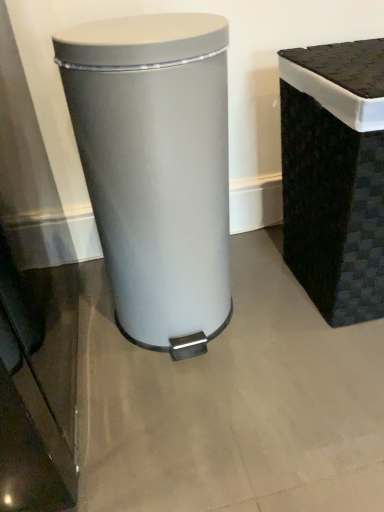
What is the approximate height of black woven basket at right, which is the 2th waste container from left to right?

black woven basket at right, which is the 2th waste container from left to right, is 22.10 inches in height.

Locate an element on the screen. The image size is (384, 512). black woven basket at right, which is the first waste container in right-to-left order is located at coordinates (335, 176).

This screenshot has height=512, width=384. Describe the element at coordinates (335, 176) in the screenshot. I see `black woven basket at right, which is the 2th waste container from left to right` at that location.

This screenshot has width=384, height=512. Find the location of `satin silver trash can at center, which is the first waste container in left-to-right order`. satin silver trash can at center, which is the first waste container in left-to-right order is located at coordinates (156, 169).

Describe the element at coordinates (156, 169) in the screenshot. I see `satin silver trash can at center, which is the first waste container in left-to-right order` at that location.

Identify the location of black woven basket at right, which is the first waste container in right-to-left order. This screenshot has width=384, height=512. (335, 176).

Between black woven basket at right, which is the first waste container in right-to-left order, and satin silver trash can at center, the 2th waste container from the right, which one appears on the left side from the viewer's perspective?

satin silver trash can at center, the 2th waste container from the right.

Considering the positions of objects black woven basket at right, which is the 2th waste container from left to right, and satin silver trash can at center, the 2th waste container from the right, in the image provided, who is behind, black woven basket at right, which is the 2th waste container from left to right, or satin silver trash can at center, the 2th waste container from the right,?

black woven basket at right, which is the 2th waste container from left to right.

Considering the positions of point (302, 280) and point (148, 154), is point (302, 280) closer or farther from the camera than point (148, 154)?

Point (302, 280) is positioned farther from the camera compared to point (148, 154).

From the image's perspective, which one is positioned lower, black woven basket at right, which is the first waste container in right-to-left order, or satin silver trash can at center, which is the first waste container in left-to-right order?

satin silver trash can at center, which is the first waste container in left-to-right order, appears lower in the image.

From a real-world perspective, is black woven basket at right, which is the 2th waste container from left to right, physically located above or below satin silver trash can at center, which is the first waste container in left-to-right order?

black woven basket at right, which is the 2th waste container from left to right, is situated lower than satin silver trash can at center, which is the first waste container in left-to-right order, in the real world.

Does black woven basket at right, which is the 2th waste container from left to right, have a greater width compared to satin silver trash can at center, the 2th waste container from the right?

Correct, the width of black woven basket at right, which is the 2th waste container from left to right, exceeds that of satin silver trash can at center, the 2th waste container from the right.

Considering the relative sizes of black woven basket at right, which is the 2th waste container from left to right, and satin silver trash can at center, which is the first waste container in left-to-right order, in the image provided, is black woven basket at right, which is the 2th waste container from left to right, shorter than satin silver trash can at center, which is the first waste container in left-to-right order,?

Yes.

Based on their sizes in the image, would you say black woven basket at right, which is the first waste container in right-to-left order, is bigger or smaller than satin silver trash can at center, the 2th waste container from the right?

Clearly, black woven basket at right, which is the first waste container in right-to-left order, is larger in size than satin silver trash can at center, the 2th waste container from the right.

Which is correct: black woven basket at right, which is the first waste container in right-to-left order, is inside satin silver trash can at center, the 2th waste container from the right, or outside of it?

black woven basket at right, which is the first waste container in right-to-left order, cannot be found inside satin silver trash can at center, the 2th waste container from the right.

Does black woven basket at right, which is the first waste container in right-to-left order, touch satin silver trash can at center, the 2th waste container from the right?

No, black woven basket at right, which is the first waste container in right-to-left order, is not beside satin silver trash can at center, the 2th waste container from the right.

Is black woven basket at right, which is the first waste container in right-to-left order, aimed at satin silver trash can at center, the 2th waste container from the right?

No, black woven basket at right, which is the first waste container in right-to-left order, is not turned towards satin silver trash can at center, the 2th waste container from the right.

How many degrees apart are the facing directions of black woven basket at right, which is the 2th waste container from left to right, and satin silver trash can at center, the 2th waste container from the right?

They differ by 0.00237 degrees in their facing directions.

Measure the distance from black woven basket at right, which is the first waste container in right-to-left order, to satin silver trash can at center, which is the first waste container in left-to-right order.

black woven basket at right, which is the first waste container in right-to-left order, is 11.56 inches from satin silver trash can at center, which is the first waste container in left-to-right order.

You are a GUI agent. You are given a task and a screenshot of the screen. Output one action in this format:
    pyautogui.click(x=<x>, y=<y>)
    Task: Click on the waste container that appears below the black woven basket at right, which is the 2th waste container from left to right (from the image's perspective)
    This screenshot has width=384, height=512.
    Given the screenshot: What is the action you would take?
    pyautogui.click(x=156, y=169)

Can you confirm if satin silver trash can at center, the 2th waste container from the right, is positioned to the left of black woven basket at right, which is the first waste container in right-to-left order?

Correct, you'll find satin silver trash can at center, the 2th waste container from the right, to the left of black woven basket at right, which is the first waste container in right-to-left order.

Considering the relative positions of satin silver trash can at center, which is the first waste container in left-to-right order, and black woven basket at right, which is the first waste container in right-to-left order, in the image provided, is satin silver trash can at center, which is the first waste container in left-to-right order, behind black woven basket at right, which is the first waste container in right-to-left order,?

That is False.

Is point (178, 210) positioned before point (329, 315)?

Yes.

From the image's perspective, which is below, satin silver trash can at center, which is the first waste container in left-to-right order, or black woven basket at right, which is the 2th waste container from left to right?

satin silver trash can at center, which is the first waste container in left-to-right order.

From a real-world perspective, is satin silver trash can at center, which is the first waste container in left-to-right order, under black woven basket at right, which is the 2th waste container from left to right?

Actually, satin silver trash can at center, which is the first waste container in left-to-right order, is physically above black woven basket at right, which is the 2th waste container from left to right, in the real world.

Considering the sizes of objects satin silver trash can at center, which is the first waste container in left-to-right order, and black woven basket at right, which is the 2th waste container from left to right, in the image provided, who is thinner, satin silver trash can at center, which is the first waste container in left-to-right order, or black woven basket at right, which is the 2th waste container from left to right,?

Thinner between the two is satin silver trash can at center, which is the first waste container in left-to-right order.

Is satin silver trash can at center, which is the first waste container in left-to-right order, taller or shorter than black woven basket at right, which is the first waste container in right-to-left order?

Considering their sizes, satin silver trash can at center, which is the first waste container in left-to-right order, has more height than black woven basket at right, which is the first waste container in right-to-left order.

Between satin silver trash can at center, the 2th waste container from the right, and black woven basket at right, which is the first waste container in right-to-left order, which one has smaller size?

Smaller between the two is satin silver trash can at center, the 2th waste container from the right.

Is satin silver trash can at center, the 2th waste container from the right, situated inside black woven basket at right, which is the first waste container in right-to-left order, or outside?

satin silver trash can at center, the 2th waste container from the right, is located beyond the bounds of black woven basket at right, which is the first waste container in right-to-left order.

Is satin silver trash can at center, the 2th waste container from the right, touching black woven basket at right, which is the 2th waste container from left to right?

There is a gap between satin silver trash can at center, the 2th waste container from the right, and black woven basket at right, which is the 2th waste container from left to right.

Is satin silver trash can at center, which is the first waste container in left-to-right order, turned away from black woven basket at right, which is the 2th waste container from left to right?

No, satin silver trash can at center, which is the first waste container in left-to-right order,'s orientation is not away from black woven basket at right, which is the 2th waste container from left to right.

How many degrees apart are the facing directions of satin silver trash can at center, which is the first waste container in left-to-right order, and black woven basket at right, which is the 2th waste container from left to right?

The angular difference between satin silver trash can at center, which is the first waste container in left-to-right order, and black woven basket at right, which is the 2th waste container from left to right, is 0.00237 degrees.

The width and height of the screenshot is (384, 512). Find the location of `waste container that is on the left side of black woven basket at right, which is the 2th waste container from left to right`. waste container that is on the left side of black woven basket at right, which is the 2th waste container from left to right is located at coordinates (156, 169).

Identify the location of waste container that is behind the satin silver trash can at center, which is the first waste container in left-to-right order. The image size is (384, 512). [335, 176].

In order to click on waste container lying on the left of black woven basket at right, which is the 2th waste container from left to right in this screenshot , I will do `click(156, 169)`.